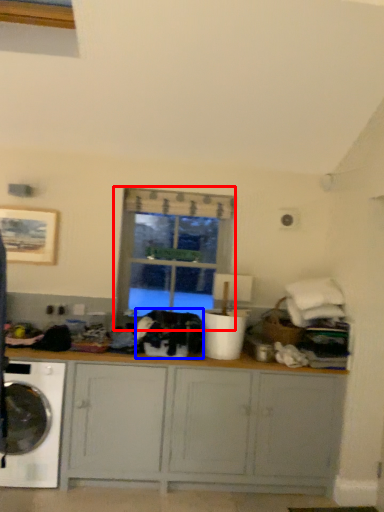
Question: Which point is closer to the camera, window (highlighted by a red box) or clothing (highlighted by a blue box)?

Choices:
 (A) window
 (B) clothing

Answer: (B)